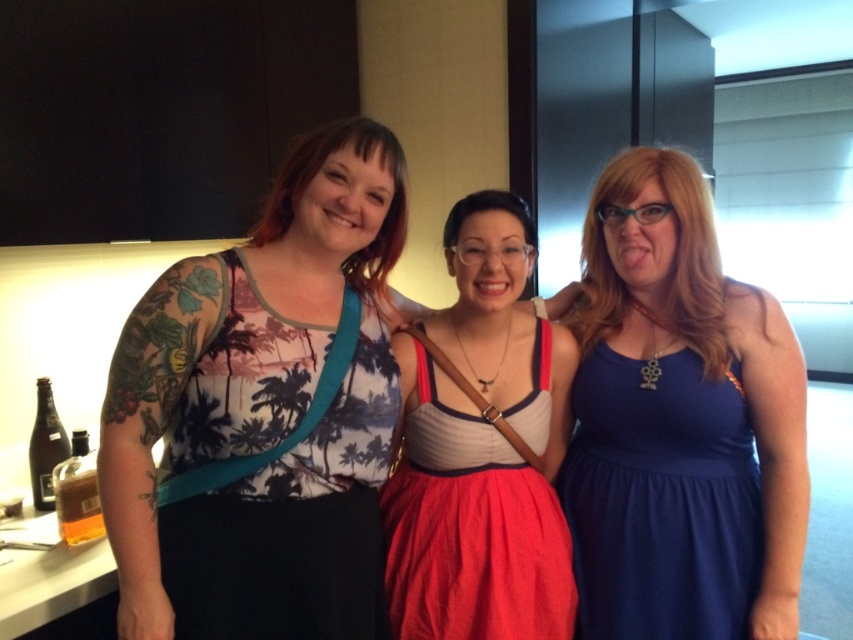
What do you see at coordinates (263, 412) in the screenshot? I see `printed fabric top at center` at bounding box center [263, 412].

What do you see at coordinates (263, 412) in the screenshot? I see `printed fabric top at center` at bounding box center [263, 412].

Image resolution: width=853 pixels, height=640 pixels. What are the coordinates of `printed fabric top at center` in the screenshot? It's located at (263, 412).

Between printed fabric dress at center and navy blue fabric dress at right, which one has less height?

navy blue fabric dress at right is shorter.

Between printed fabric dress at center and navy blue fabric dress at right, which one is positioned higher?

printed fabric dress at center

Does point (299, 632) lie behind point (619, 596)?

That is False.

This screenshot has width=853, height=640. I want to click on printed fabric dress at center, so click(279, 476).

In the scene shown: Is printed fabric top at center above matte red dress at center?

Correct, printed fabric top at center is located above matte red dress at center.

What do you see at coordinates (263, 412) in the screenshot? Image resolution: width=853 pixels, height=640 pixels. I see `printed fabric top at center` at bounding box center [263, 412].

This screenshot has height=640, width=853. I want to click on printed fabric top at center, so click(x=263, y=412).